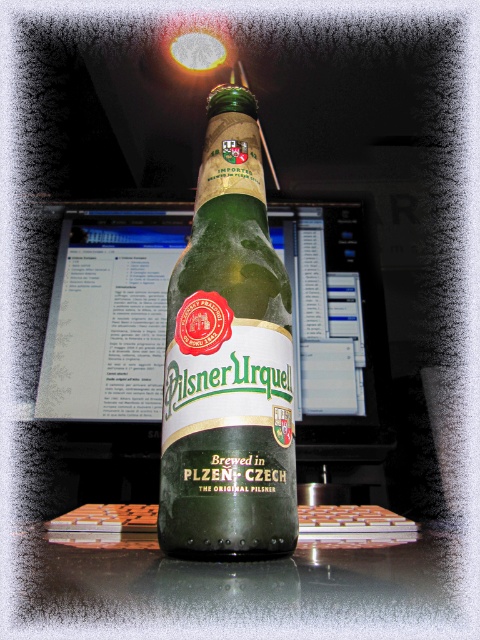
Between green glass bottle at center and matte plastic monitor at center, which one appears on the left side from the viewer's perspective?

matte plastic monitor at center is more to the left.

Locate an element on the screen. This screenshot has width=480, height=640. green glass bottle at center is located at coordinates (228, 360).